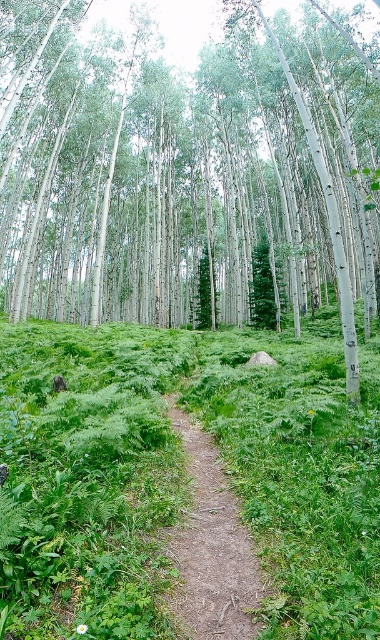
Question: Which of the following is the closest to the observer?

Choices:
 (A) green leafy grass at center
 (B) dirt path at center

Answer: (A)

Question: Which of the following is the closest to the observer?

Choices:
 (A) (147, 424)
 (B) (106, 74)

Answer: (A)

Question: Does white smooth tree at center have a smaller size compared to dirt path at center?

Choices:
 (A) yes
 (B) no

Answer: (B)

Question: Can you confirm if white smooth tree at center is positioned to the right of green leafy grass at center?

Choices:
 (A) no
 (B) yes

Answer: (A)

Question: Is green leafy grass at center to the left of dirt path at center from the viewer's perspective?

Choices:
 (A) no
 (B) yes

Answer: (B)

Question: Among these objects, which one is farthest from the camera?

Choices:
 (A) green leafy grass at center
 (B) white smooth tree at center
 (C) dirt path at center

Answer: (B)